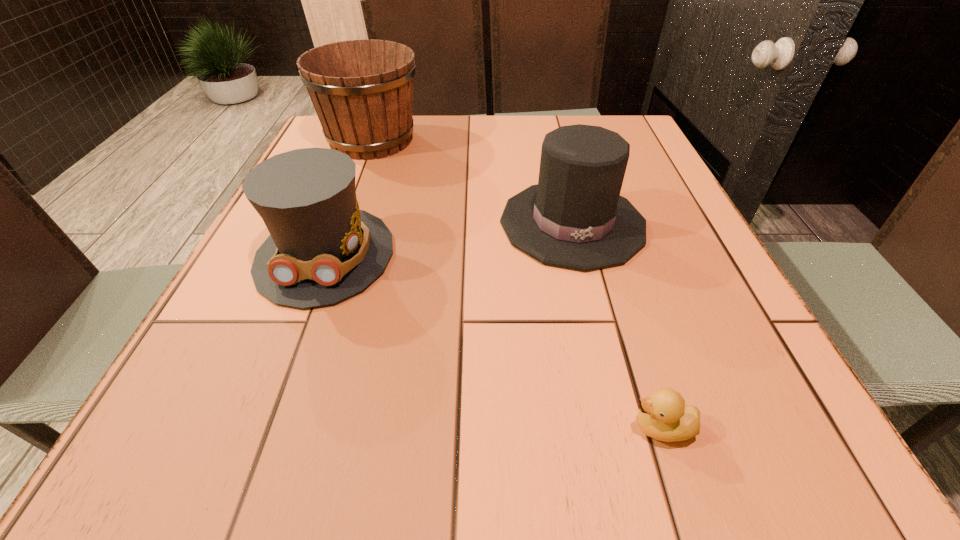
The width and height of the screenshot is (960, 540). In order to click on unoccupied area between the right dress hat and the duckling in this screenshot , I will do `click(617, 326)`.

Find the location of `vacant space in between the farthest object and the duckling`. vacant space in between the farthest object and the duckling is located at coordinates (516, 284).

Identify the location of object identified as the third closest to the farthest object. (663, 416).

Locate which object is the second closest to the farthest object. Please provide its 2D coordinates. Your answer should be formatted as a tuple, i.e. [(x, y)], where the tuple contains the x and y coordinates of a point satisfying the conditions above.

[(575, 218)]